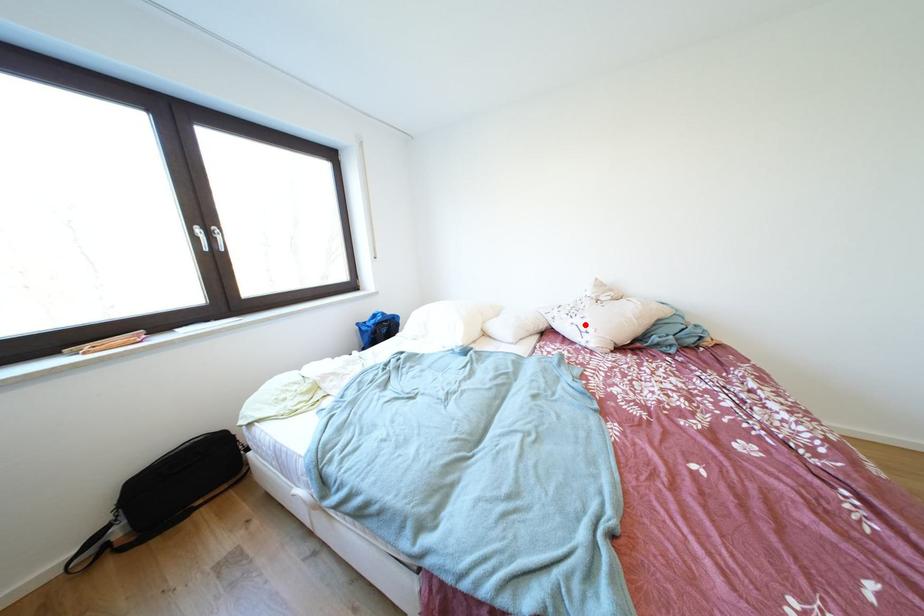
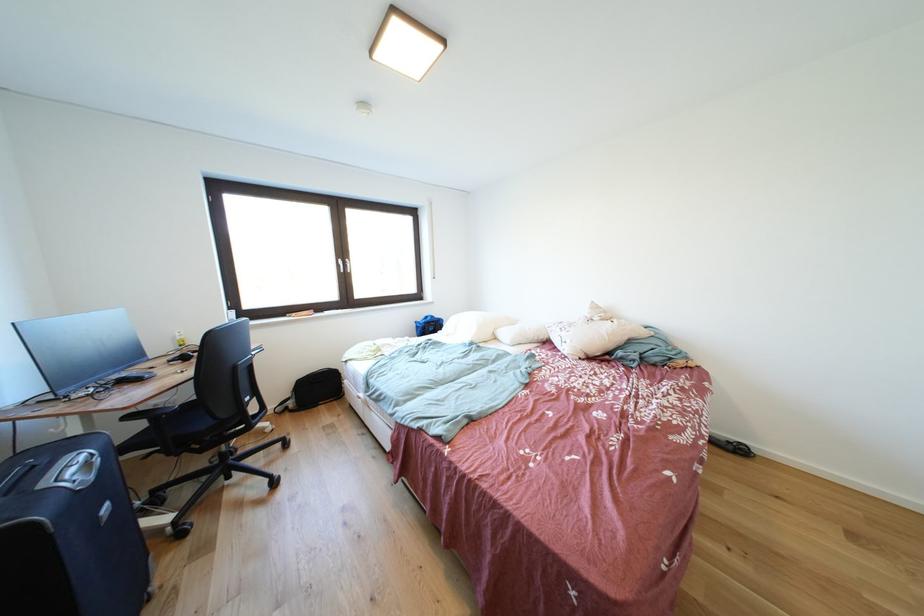
The point at the highlighted location is marked in the first image. Where is the corresponding point in the second image?

(572, 338)